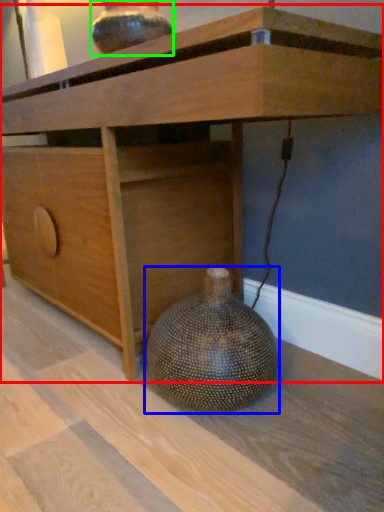
Question: Which object is the farthest from table (highlighted by a red box)? Choose among these: vase (highlighted by a blue box) or vase (highlighted by a green box).

Choices:
 (A) vase
 (B) vase

Answer: (A)